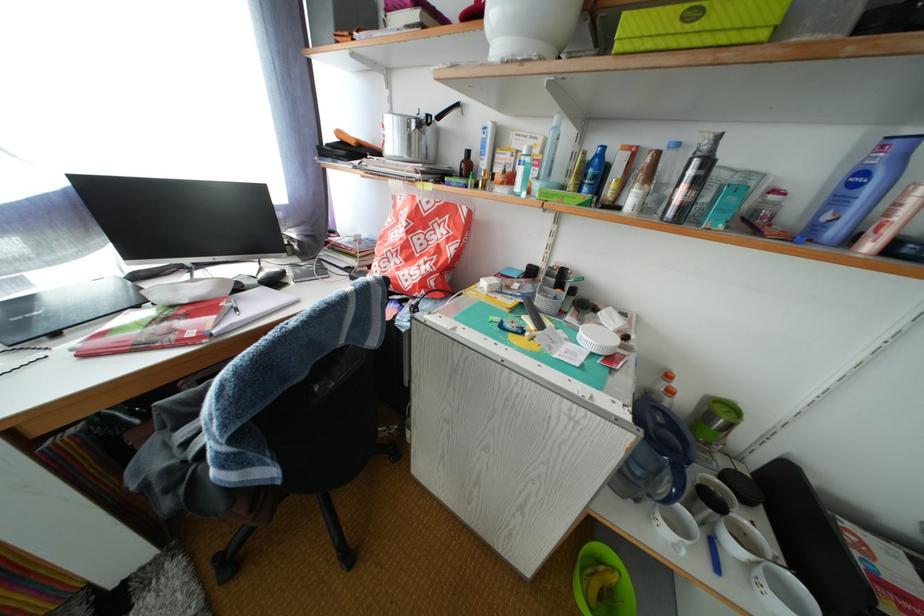
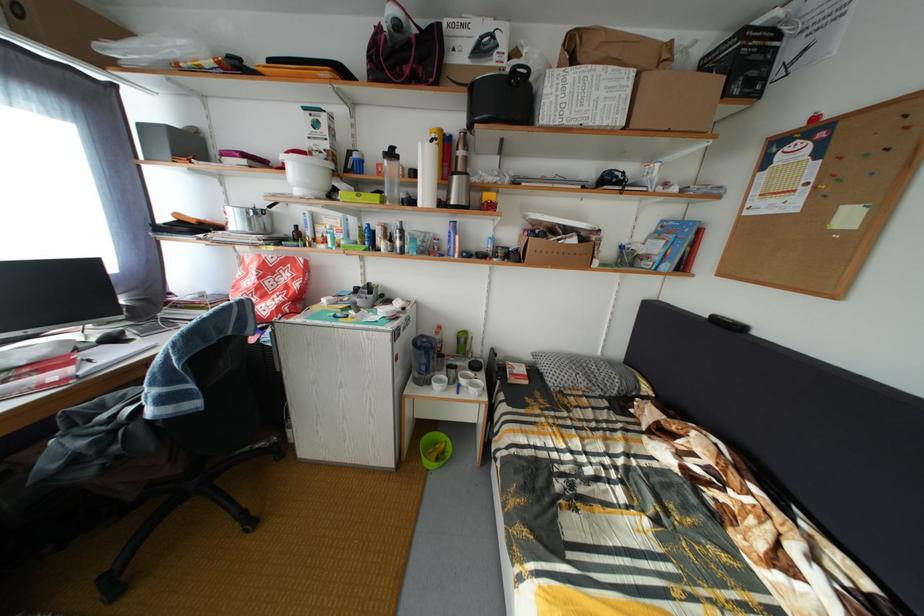
The point at (x=722, y=548) is marked in the first image. Where is the corresponding point in the second image?

(468, 392)